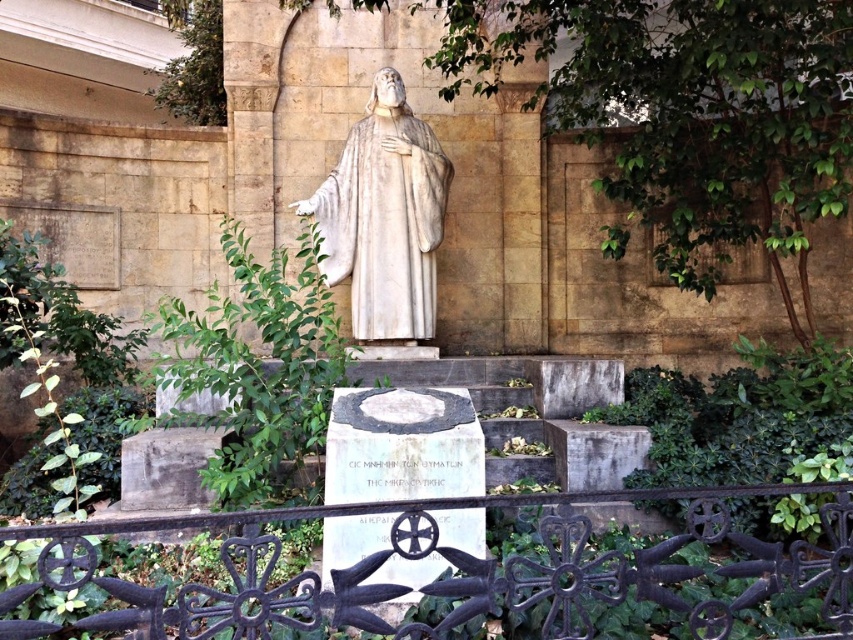
Find the location of a particular element. black wrought iron fence at lower center is located at coordinates (459, 570).

Is black wrought iron fence at lower center wider than white marble statue at center?

Yes.

Does point (268, 634) come closer to viewer compared to point (360, 246)?

Yes, point (268, 634) is in front of point (360, 246).

You are a GUI agent. You are given a task and a screenshot of the screen. Output one action in this format:
    pyautogui.click(x=<x>, y=<y>)
    Task: Click on the black wrought iron fence at lower center
    
    Given the screenshot: What is the action you would take?
    pyautogui.click(x=459, y=570)